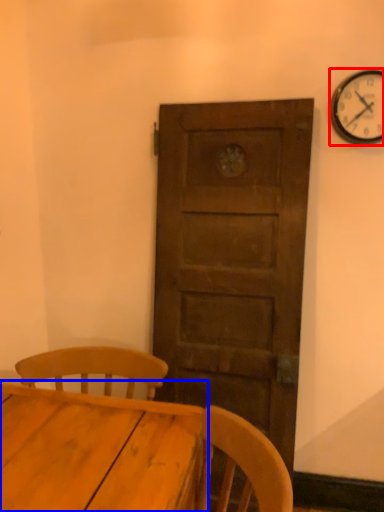
Question: Which point is closer to the camera, wall clock (highlighted by a red box) or table (highlighted by a blue box)?

Choices:
 (A) wall clock
 (B) table

Answer: (B)